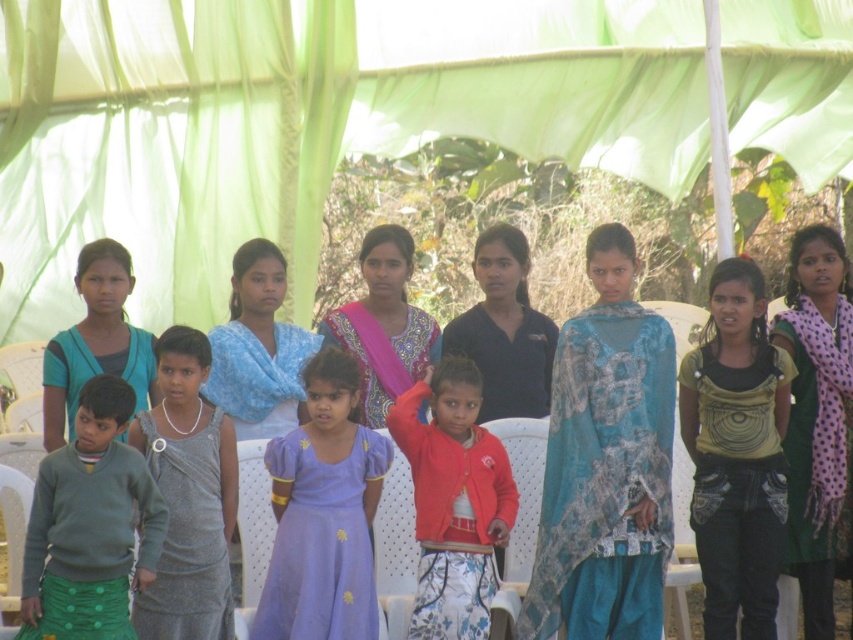
Question: Is purple satin dress at center smaller than teal fabric sari at center?

Choices:
 (A) yes
 (B) no

Answer: (A)

Question: Among these objects, which one is nearest to the camera?

Choices:
 (A) black matte shirt at center
 (B) red matte cardigan at center
 (C) polka dot scarf at right

Answer: (B)

Question: Which of the following is the farthest from the observer?

Choices:
 (A) blue printed fabric dress at center
 (B) printed cotton saree at center
 (C) red matte cardigan at center
 (D) sparkly silver dress at center

Answer: (B)

Question: Is matte green sweater at center below blue fabric scarf at center?

Choices:
 (A) yes
 (B) no

Answer: (A)

Question: Does black matte shirt at center appear on the left side of printed cotton saree at center?

Choices:
 (A) no
 (B) yes

Answer: (A)

Question: Which point is closer to the camera taking this photo?

Choices:
 (A) (733, 474)
 (B) (152, 628)

Answer: (B)